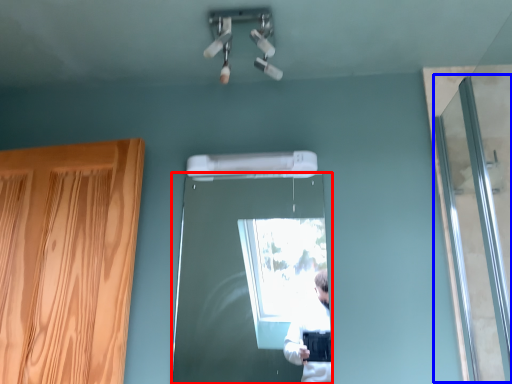
Question: Which point is closer to the camera, door (highlighted by a red box) or screen door (highlighted by a blue box)?

Choices:
 (A) door
 (B) screen door

Answer: (B)